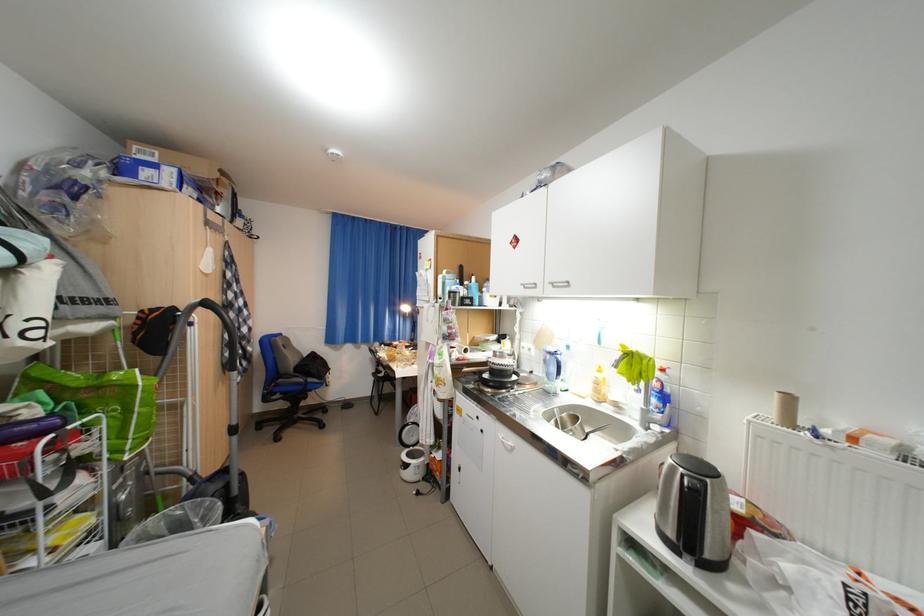
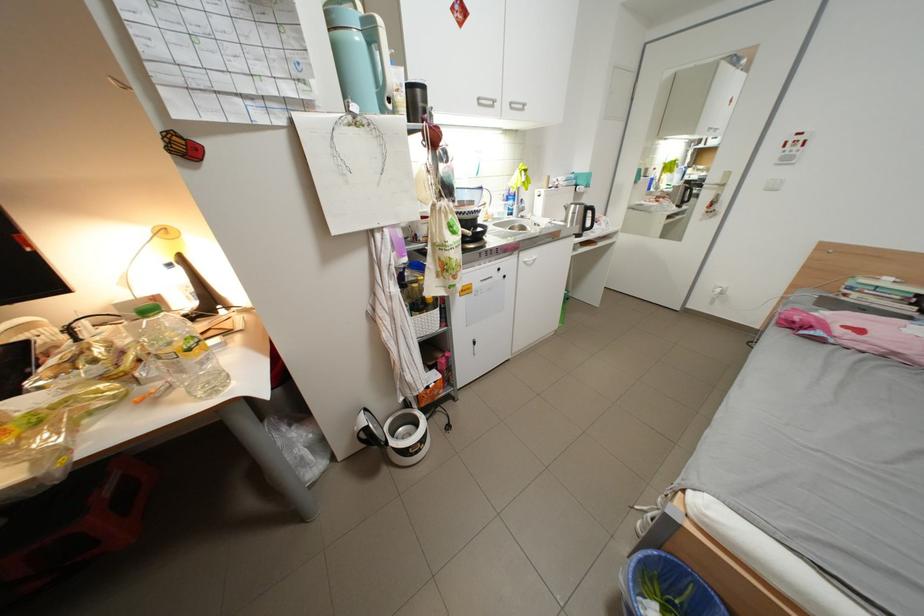
Locate, in the second image, the point that corresponds to point 419,451 in the first image.

(404, 444)